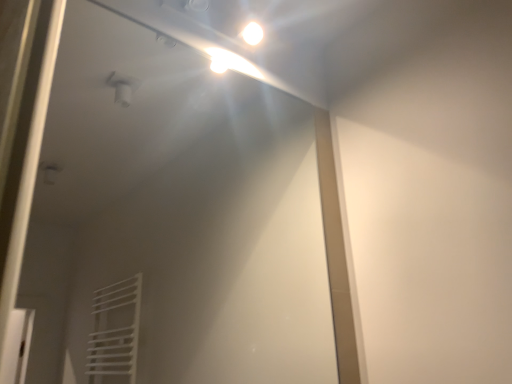
Where is `white glossy mirror at upper center`? white glossy mirror at upper center is located at coordinates (172, 220).

Describe the element at coordinates (172, 220) in the screenshot. I see `white glossy mirror at upper center` at that location.

In order to face white glossy mirror at upper center, should I rotate leftwards or rightwards?

To align with it, rotate left about 6.094°.

I want to click on white glossy mirror at upper center, so click(x=172, y=220).